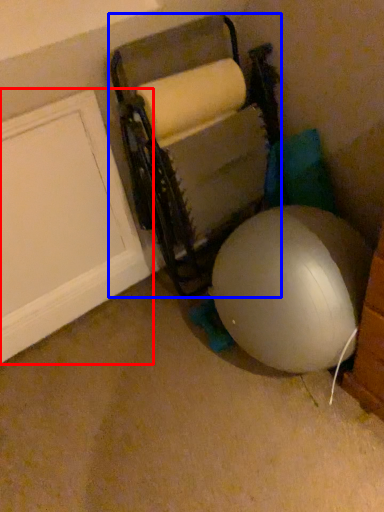
Question: Which object is further to the camera taking this photo, door (highlighted by a red box) or bean bag chair (highlighted by a blue box)?

Choices:
 (A) door
 (B) bean bag chair

Answer: (A)